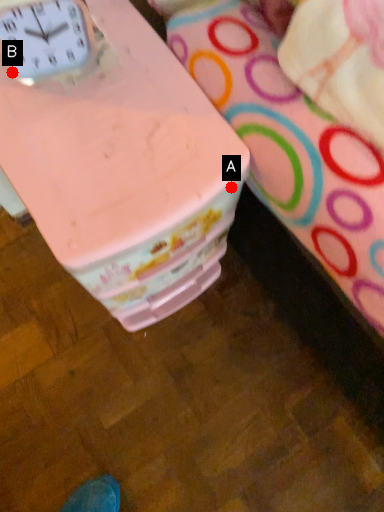
Question: Two points are circled on the image, labeled by A and B beside each circle. Which point is farther to the camera?

Choices:
 (A) A is further
 (B) B is further

Answer: (B)